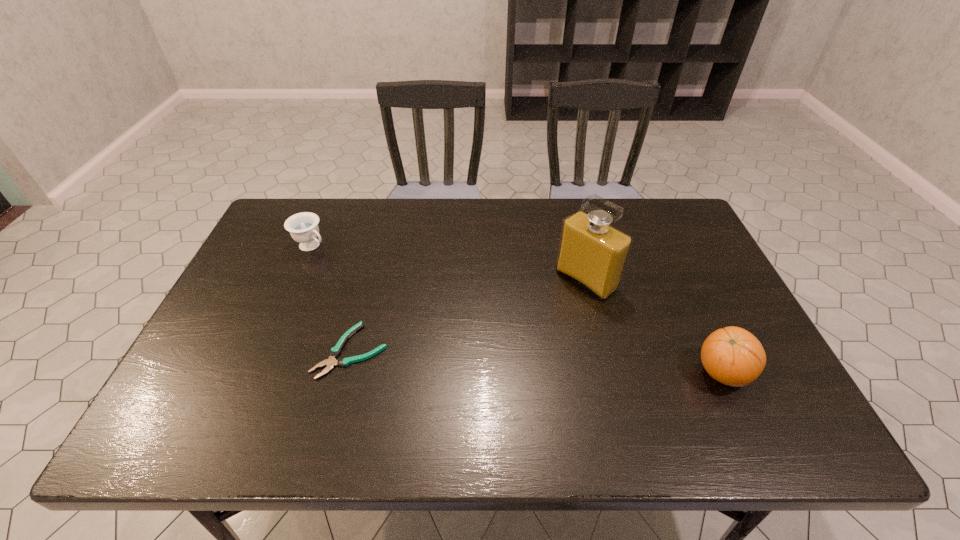
Find the location of `free space that satisfies the following two spatial constraints: 1. on the front side of the third object from right to left; 2. on the left side of the second shortest object`. free space that satisfies the following two spatial constraints: 1. on the front side of the third object from right to left; 2. on the left side of the second shortest object is located at coordinates (267, 350).

What are the coordinates of `blank area in the image that satisfies the following two spatial constraints: 1. on the back side of the shortest object; 2. on the right side of the perfume` in the screenshot? It's located at (370, 280).

Where is `vacant space that satisfies the following two spatial constraints: 1. on the front side of the second object from left to right; 2. on the right side of the third shortest object`? vacant space that satisfies the following two spatial constraints: 1. on the front side of the second object from left to right; 2. on the right side of the third shortest object is located at coordinates (346, 373).

Find the location of a particular element. The height and width of the screenshot is (540, 960). free spot that satisfies the following two spatial constraints: 1. on the front side of the leftmost object; 2. on the left side of the third object from right to left is located at coordinates (267, 350).

Where is `vacant space that satisfies the following two spatial constraints: 1. on the back side of the pliers; 2. on the left side of the perfume`? vacant space that satisfies the following two spatial constraints: 1. on the back side of the pliers; 2. on the left side of the perfume is located at coordinates (370, 280).

Locate an element on the screen. free space that satisfies the following two spatial constraints: 1. on the front side of the third shortest object; 2. on the left side of the pliers is located at coordinates (346, 373).

The width and height of the screenshot is (960, 540). I want to click on free point that satisfies the following two spatial constraints: 1. on the front side of the third object from left to right; 2. on the left side of the second tallest object, so click(609, 373).